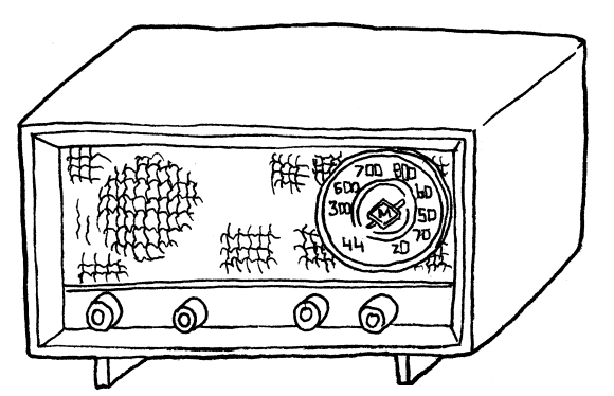
Find the location of a particular element. Image resolution: width=614 pixels, height=396 pixels. speaker is located at coordinates (85, 160), (263, 244), (150, 200).